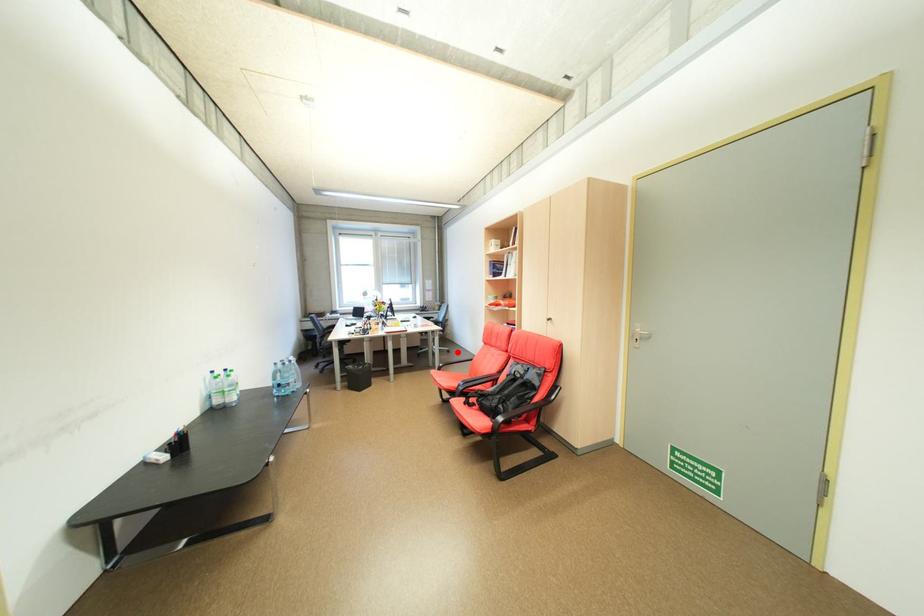
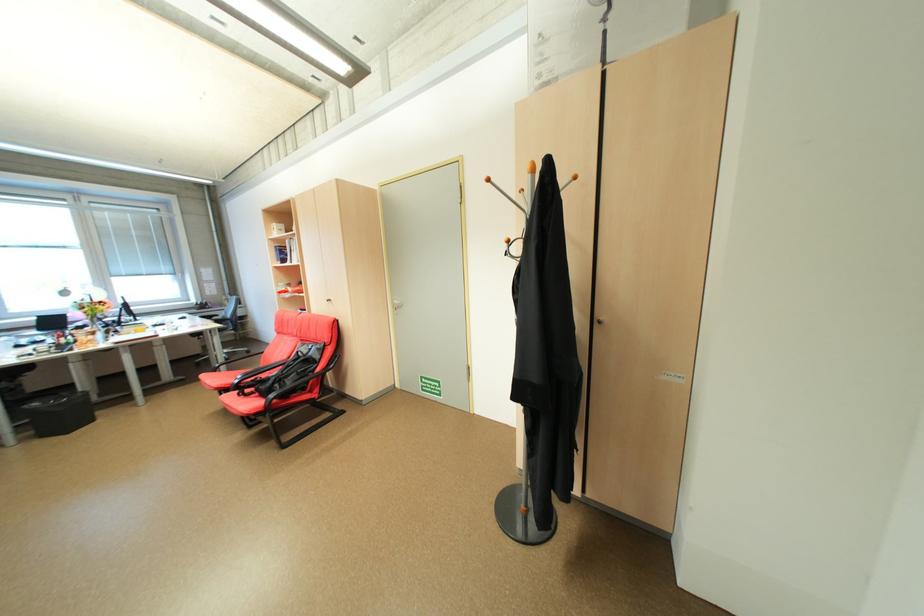
Question: I am providing you with two images of the same scene from different viewpoints. A red point is shown in image1. For the corresponding object point in image2, is it positioned nearer or farther from the camera?

Choices:
 (A) Nearer
 (B) Farther

Answer: (B)